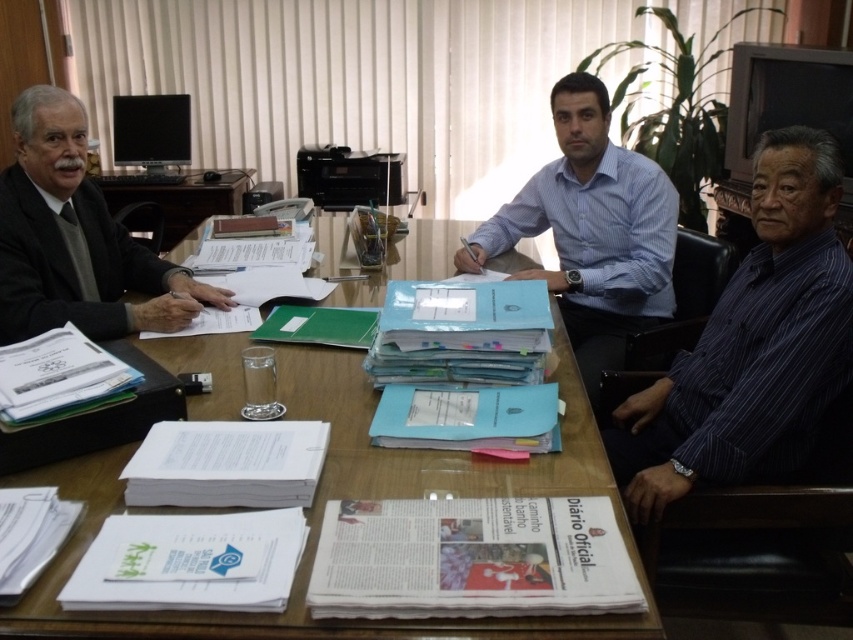
Does dark blue striped shirt at lower right have a lesser height compared to blue striped shirt at center?

Indeed, dark blue striped shirt at lower right has a lesser height compared to blue striped shirt at center.

Who is more distant from viewer, (x=753, y=348) or (x=546, y=164)?

Point (x=546, y=164)

Locate an element on the screen. The height and width of the screenshot is (640, 853). dark blue striped shirt at lower right is located at coordinates (751, 344).

Can you confirm if wooden table at center is wider than blue striped shirt at center?

Yes, wooden table at center is wider than blue striped shirt at center.

Does wooden table at center appear on the left side of blue striped shirt at center?

Correct, you'll find wooden table at center to the left of blue striped shirt at center.

Does point (619, 614) lie behind point (640, 202)?

No, it is in front of (640, 202).

Where is `wooden table at center`? This screenshot has width=853, height=640. wooden table at center is located at coordinates (343, 497).

Can you confirm if wooden table at center is bigger than dark blue striped shirt at lower right?

Correct, wooden table at center is larger in size than dark blue striped shirt at lower right.

Between point (347, 465) and point (699, 365), which one is positioned in front?

Point (347, 465)

Where is `wooden table at center`? wooden table at center is located at coordinates (343, 497).